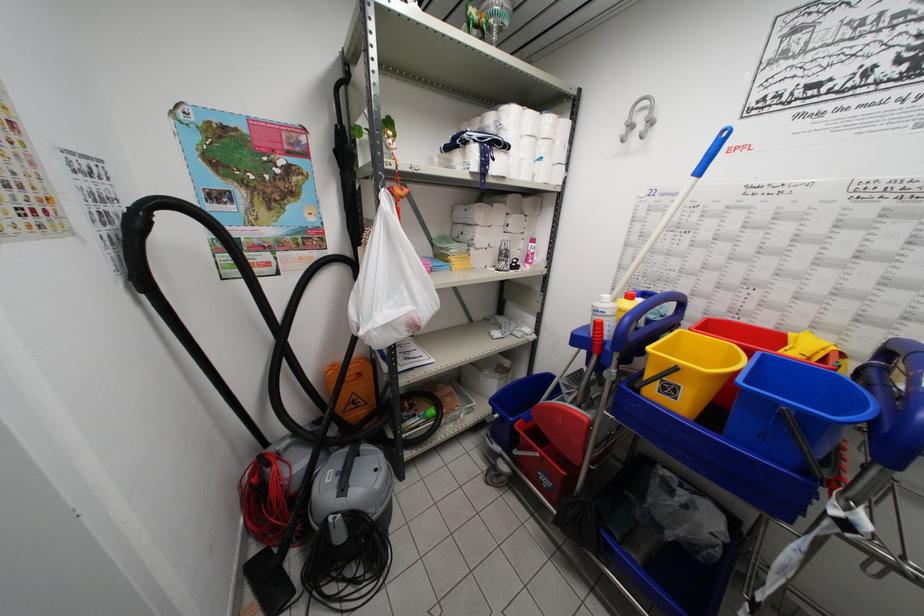
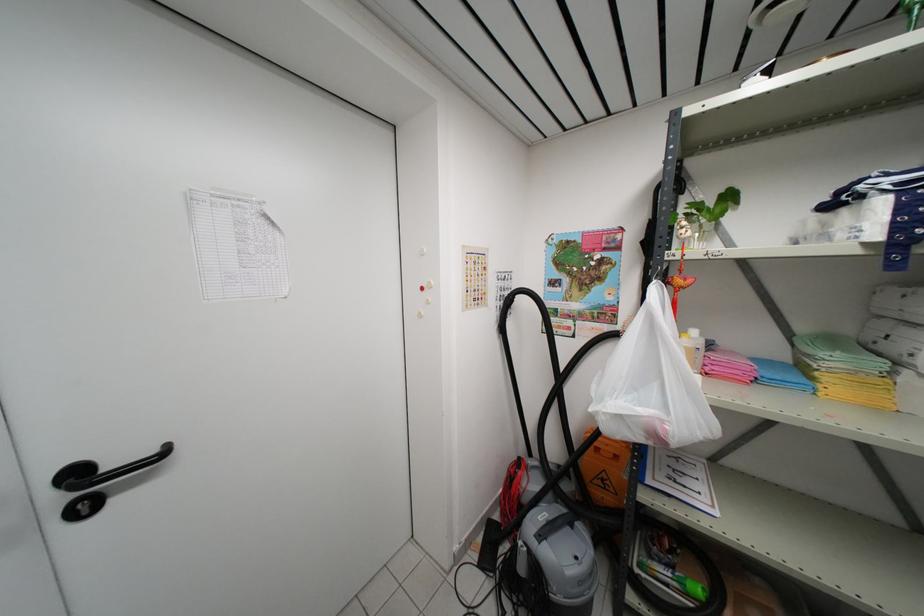
Where in the second image is the point corresponding to (x=361, y=408) from the first image?

(610, 492)